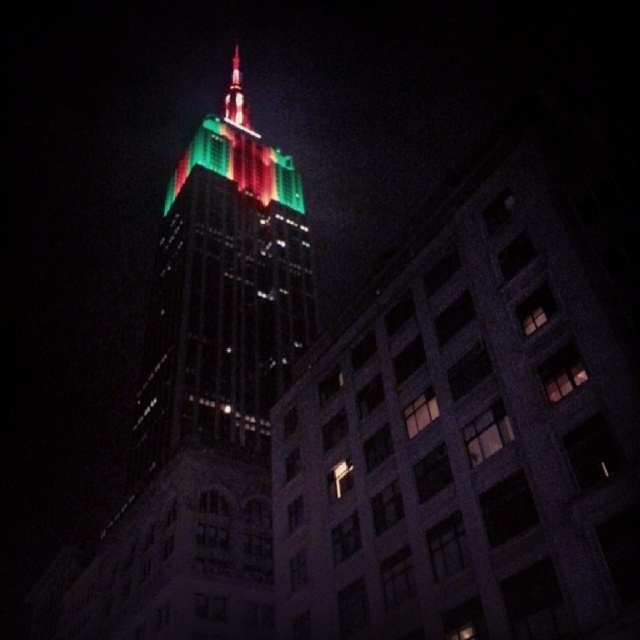
You are standing in a park across from the green glass skyscraper at center. You want to take a photo of the skyscraper with your smartphone. The recommended distance for capturing the entire building in one frame is 45 meters. Is your current position too close or too far?

You are standing 46.82 meters away from the green glass skyscraper at center, which is slightly farther than the recommended 45 meters. To capture the entire building in one frame, you might need to move slightly closer.

You are standing in the city square and see the green glass skyscraper at center and the shiny glass spire at upper center. If you want to take a photo that includes both objects in the frame, would their distance apart allow you to capture them together?

The green glass skyscraper at center is 53.29 meters away from the shiny glass spire at upper center. Since they are positioned close to each other in the scene, you can easily capture both in a single photo frame.

You are an architect analyzing the Empire State Building at night. You notice the green glass skyscraper at center and the shiny glass spire at upper center. Which of these two structures appears smaller in size when viewed from your current position?

The green glass skyscraper at center appears smaller in size compared to the shiny glass spire at upper center.